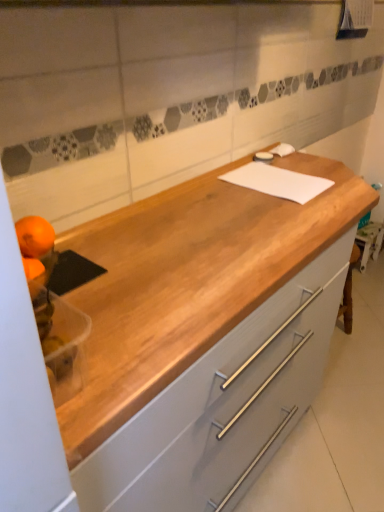
Question: Is orangesmoothfruit at left, which appears as the second orange when ordered from the bottom, to the left of orange matte at left, marked as the 2th orange in a top-to-bottom arrangement, from the viewer's perspective?

Choices:
 (A) no
 (B) yes

Answer: (A)

Question: Considering the relative sizes of orangesmoothfruit at left, which appears as the second orange when ordered from the bottom, and orange matte at left, the first orange positioned from the bottom, in the image provided, is orangesmoothfruit at left, which appears as the second orange when ordered from the bottom, shorter than orange matte at left, the first orange positioned from the bottom,?

Choices:
 (A) yes
 (B) no

Answer: (A)

Question: From a real-world perspective, is orangesmoothfruit at left, which appears as the second orange when ordered from the bottom, physically above orange matte at left, the first orange positioned from the bottom?

Choices:
 (A) no
 (B) yes

Answer: (B)

Question: Is orangesmoothfruit at left, which is the first orange from top to bottom, far away from orange matte at left, marked as the 2th orange in a top-to-bottom arrangement?

Choices:
 (A) yes
 (B) no

Answer: (B)

Question: Is orangesmoothfruit at left, which appears as the second orange when ordered from the bottom, turned away from orange matte at left, the first orange positioned from the bottom?

Choices:
 (A) no
 (B) yes

Answer: (A)

Question: In terms of size, does white matte cutting board at center appear bigger or smaller than light gray wood cabinet at center?

Choices:
 (A) small
 (B) big

Answer: (A)

Question: Is point (248, 176) closer or farther from the camera than point (168, 497)?

Choices:
 (A) farther
 (B) closer

Answer: (A)

Question: Considering the positions of white matte cutting board at center and light gray wood cabinet at center in the image, is white matte cutting board at center wider or thinner than light gray wood cabinet at center?

Choices:
 (A) wide
 (B) thin

Answer: (B)

Question: From the image's perspective, is white matte cutting board at center positioned above or below light gray wood cabinet at center?

Choices:
 (A) above
 (B) below

Answer: (A)

Question: Considering the positions of point (x=41, y=226) and point (x=317, y=180), is point (x=41, y=226) closer or farther from the camera than point (x=317, y=180)?

Choices:
 (A) farther
 (B) closer

Answer: (B)

Question: From a real-world perspective, is orange matte at left, the first orange positioned from the bottom, physically located above or below white matte cutting board at center?

Choices:
 (A) below
 (B) above

Answer: (B)

Question: From the image's perspective, relative to white matte cutting board at center, is orange matte at left, marked as the 2th orange in a top-to-bottom arrangement, above or below?

Choices:
 (A) above
 (B) below

Answer: (B)

Question: Looking at the image, does orange matte at left, the first orange positioned from the bottom, seem bigger or smaller compared to white matte cutting board at center?

Choices:
 (A) big
 (B) small

Answer: (B)

Question: From a real-world perspective, relative to white matte cutting board at center, is light gray wood cabinet at center vertically above or below?

Choices:
 (A) above
 (B) below

Answer: (B)

Question: Considering the positions of light gray wood cabinet at center and white matte cutting board at center in the image, is light gray wood cabinet at center bigger or smaller than white matte cutting board at center?

Choices:
 (A) big
 (B) small

Answer: (A)